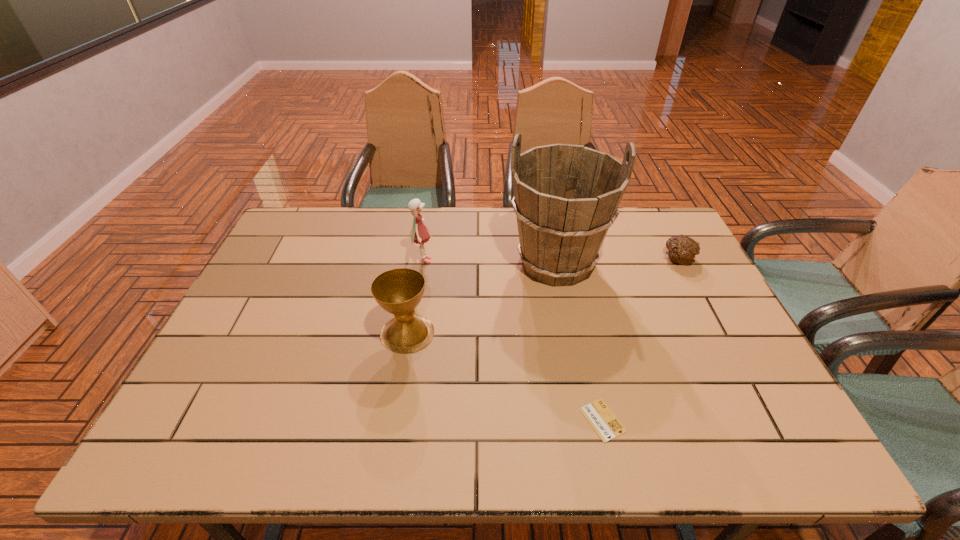
Where is `vacant position at the left edge of the desktop`? The height and width of the screenshot is (540, 960). vacant position at the left edge of the desktop is located at coordinates (251, 356).

In the image, there is a desktop. Identify the location of vacant space at the right edge. Image resolution: width=960 pixels, height=540 pixels. (647, 256).

This screenshot has width=960, height=540. In the image, there is a desktop. In order to click on vacant space at the near right corner in this screenshot , I will do `click(773, 442)`.

Where is `vacant space in between the rightmost object and the tallest object`? This screenshot has height=540, width=960. vacant space in between the rightmost object and the tallest object is located at coordinates (616, 261).

The width and height of the screenshot is (960, 540). Find the location of `free space between the rightmost object and the identity card`. free space between the rightmost object and the identity card is located at coordinates (640, 339).

You are a GUI agent. You are given a task and a screenshot of the screen. Output one action in this format:
    pyautogui.click(x=<x>, y=<y>)
    Task: Click on the vacant area between the muffin and the identity card
    The image size is (960, 540).
    Given the screenshot: What is the action you would take?
    pyautogui.click(x=640, y=339)

The height and width of the screenshot is (540, 960). Identify the location of empty space between the second shortest object and the chalice. (542, 295).

Identify the location of free spot between the shortest object and the fourth shortest object. (513, 340).

Where is `unoccupied position between the bucket and the identity card`? This screenshot has width=960, height=540. unoccupied position between the bucket and the identity card is located at coordinates (579, 342).

The height and width of the screenshot is (540, 960). I want to click on vacant region between the third shortest object and the bucket, so click(x=482, y=299).